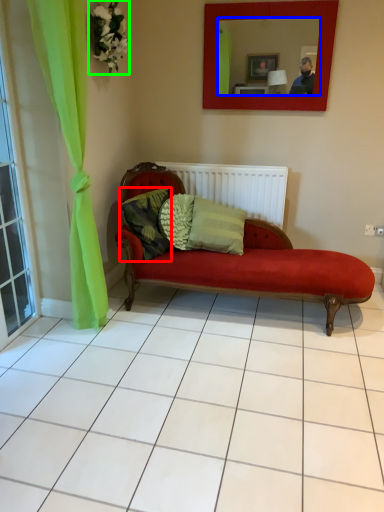
Question: Which object is positioned farthest from pillow (highlighted by a red box)? Select from mirror (highlighted by a blue box) and flower (highlighted by a green box).

Choices:
 (A) mirror
 (B) flower

Answer: (A)